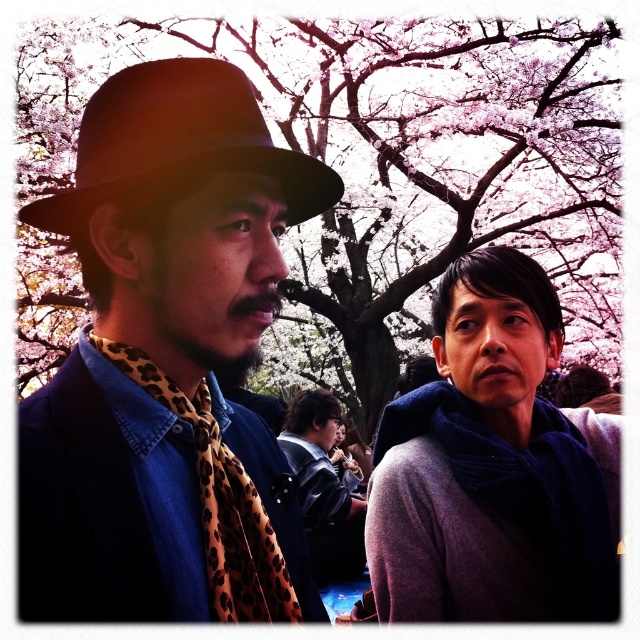
Question: Which object is farther from the camera taking this photo?

Choices:
 (A) leopard print scarf at center
 (B) pink blossom tree at upper center
 (C) matte black hat at left
 (D) black felt fedora at left

Answer: (B)

Question: Is pink blossom tree at upper center thinner than matte black hat at left?

Choices:
 (A) yes
 (B) no

Answer: (B)

Question: Which point is closer to the camera taking this photo?

Choices:
 (A) (611, 58)
 (B) (248, 488)
 (C) (289, 449)

Answer: (B)

Question: Is pink blossom tree at upper center wider than black felt fedora at left?

Choices:
 (A) no
 (B) yes

Answer: (B)

Question: Based on their relative distances, which object is farther from the black felt fedora at left?

Choices:
 (A) leopard print scarf at left
 (B) pink blossom tree at upper center
 (C) dark gray sweater at center

Answer: (B)

Question: Is the position of pink blossom tree at upper center less distant than that of leopard print scarf at left?

Choices:
 (A) no
 (B) yes

Answer: (A)